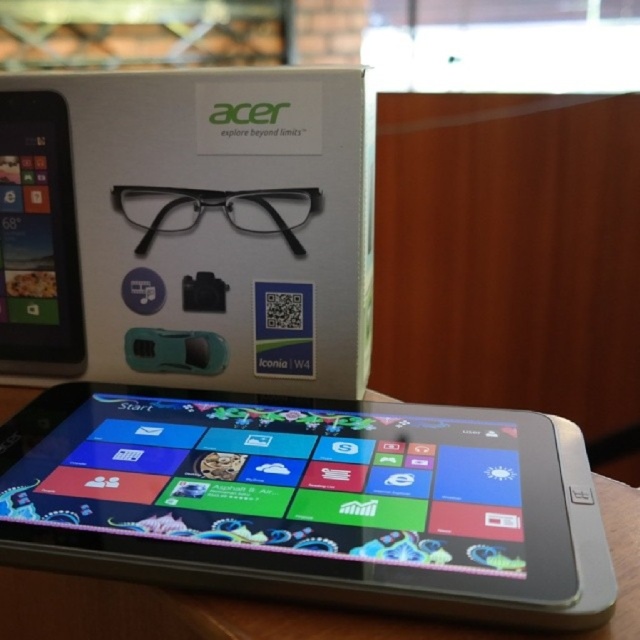
Question: Which object is positioned closest to the matte black tablet at left?

Choices:
 (A) silver metallic tablet at center
 (B) white matte box at upper center

Answer: (B)

Question: Which of the following is the farthest from the observer?

Choices:
 (A) (49, 212)
 (B) (52, 170)

Answer: (A)

Question: From the image, what is the correct spatial relationship of silver metallic tablet at center in relation to white matte box at upper center?

Choices:
 (A) above
 (B) below

Answer: (B)

Question: Is silver metallic tablet at center closer to the viewer compared to matte black tablet at left?

Choices:
 (A) no
 (B) yes

Answer: (B)

Question: Which of the following is the farthest from the observer?

Choices:
 (A) (52, 96)
 (B) (150, 115)

Answer: (A)

Question: Does silver metallic tablet at center come behind matte black tablet at left?

Choices:
 (A) no
 (B) yes

Answer: (A)